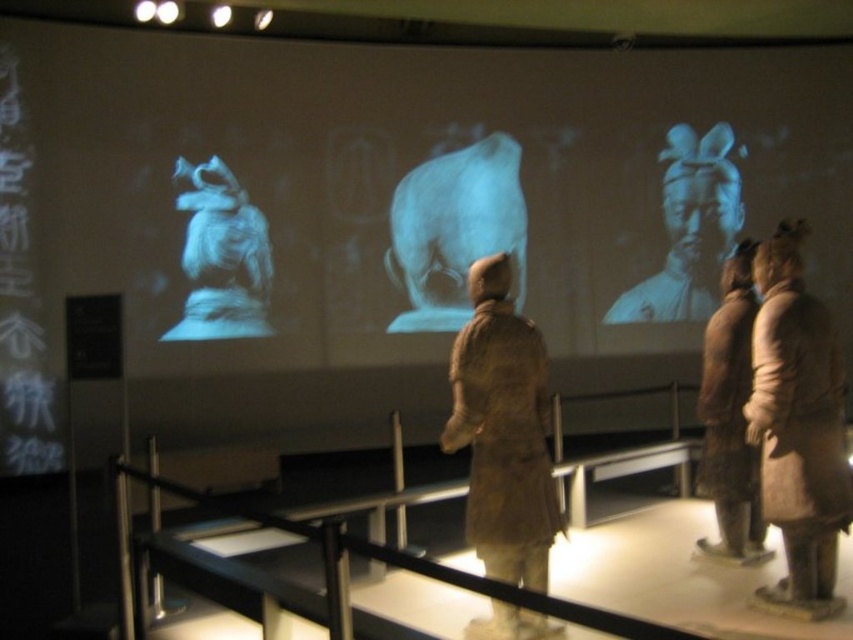
You are standing in the museum and see the point labeled as point (386, 209). Which object in the scene is this point located on?

The point labeled as point (386, 209) is located on the matte gray statue at upper center.

Looking at this image, you are standing in the museum and want to take a photo of the point at coordinates (839,397). If your camera has a maximum focus range of 10 feet, will it be able to focus on that point?

The distance of point (839,397) from the viewer is 11.32 feet, which exceeds the camera maximum focus range of 10 feet. Therefore, the camera cannot focus on that point.

You are standing in the museum and want to place a 3D model of a terracotta warrior exactly where the brown wool coat at right is located. Is this possible?

The brown wool coat at right is located at 2D point coordinates of [798,428]. Since the coat is a 2D object, you can place the 3D model of a terracotta warrior at that coordinate position.